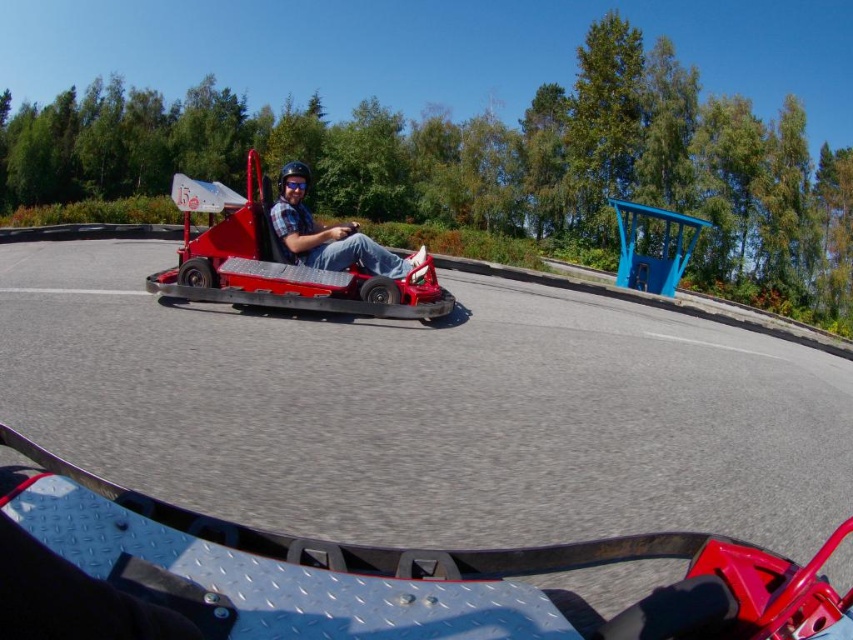
You are the driver of the red go kart with number 15. You see two points on the track ahead. The first point is at coordinates point (x=173, y=196) and the second point is at point (x=402, y=260). Which point should you aim for first to stay on the optimal racing path?

You should aim for point (x=173, y=196) first because it is in front of point (x=402, y=260) along the track.